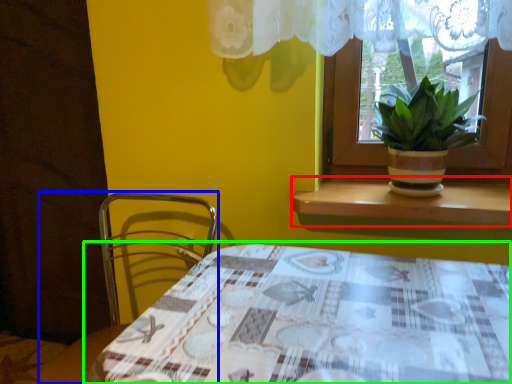
Question: Which is farther away from window sill (highlighted by a red box)? chair (highlighted by a blue box) or table (highlighted by a green box)?

Choices:
 (A) chair
 (B) table

Answer: (A)